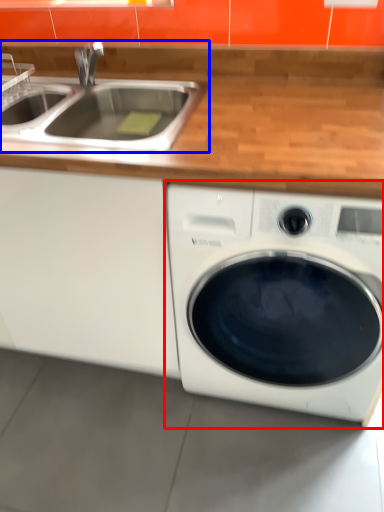
Question: Which point is closer to the camera, washing machine (highlighted by a red box) or sink (highlighted by a blue box)?

Choices:
 (A) washing machine
 (B) sink

Answer: (A)